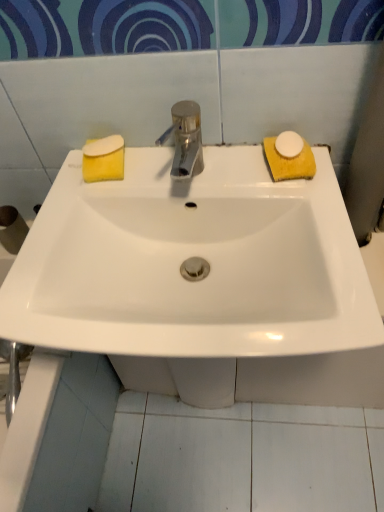
Locate an element on the screen. This screenshot has width=384, height=512. free space to the right of yellow sponge at left, the 3th soap in the right-to-left sequence is located at coordinates (178, 166).